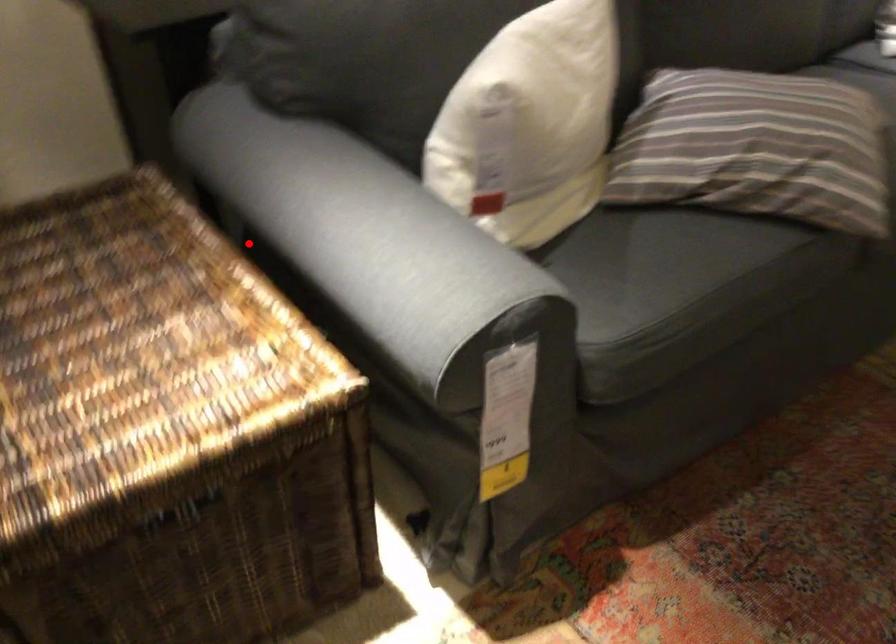
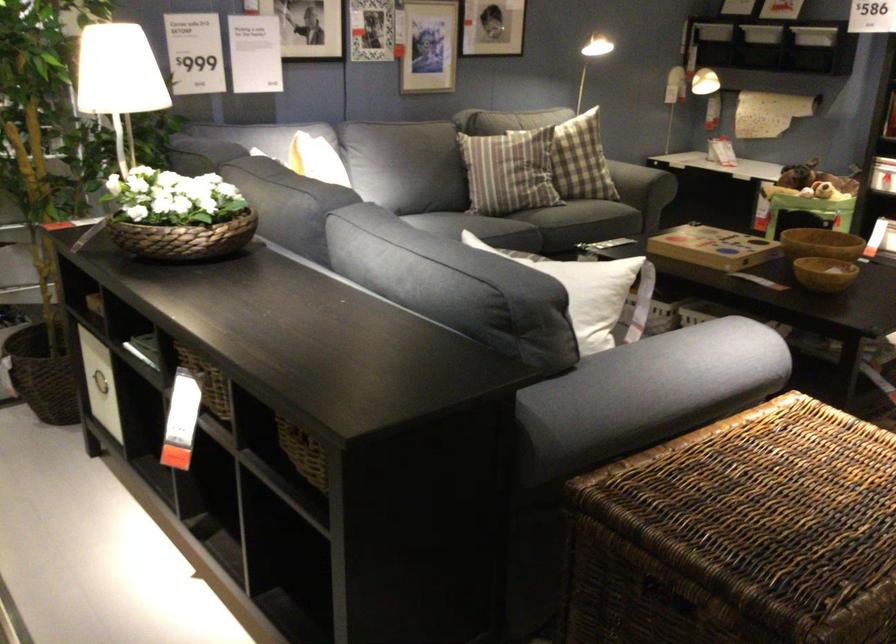
Question: I am providing you with two images of the same scene from different viewpoints. Given a red point in image1, look at the same physical point in image2. Is it:

Choices:
 (A) Closer to the viewpoint
 (B) Farther from the viewpoint

Answer: (B)